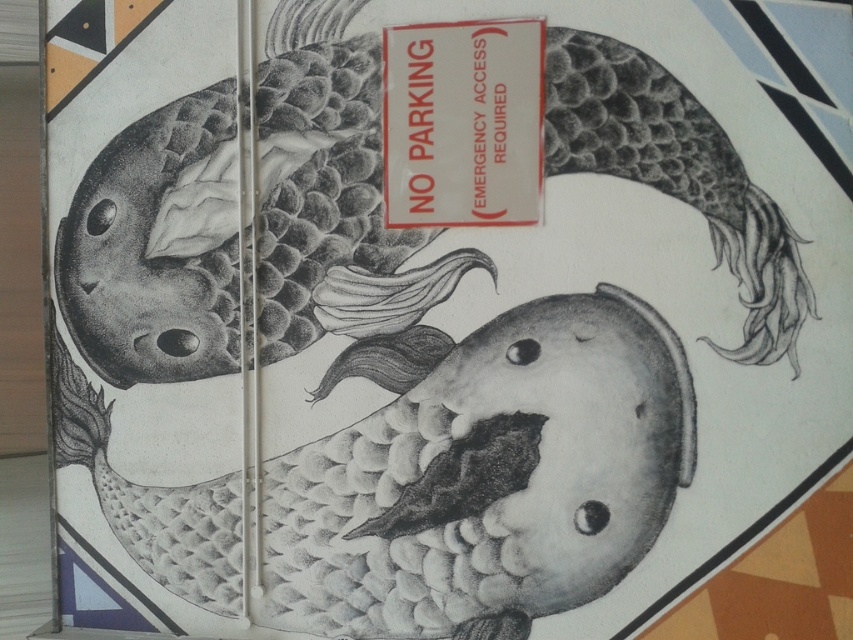
Based on the photo, you are an artist who wants to frame the gray textured fish at center and the white paper sign at upper center with two separate frames. Which object requires a wider frame?

The gray textured fish at center requires a wider frame because its width is larger than the white paper sign at upper center.

Based on the scene description, where exactly is the gray textured fish at center located in terms of coordinates?

The gray textured fish at center is located at coordinates point (155, 248).

You are an artist who wants to add a small star sticker to the image. The sticker must be placed exactly at point [155,248]. Where on the image will the star sticker be placed?

The point [155,248] is on the gray textured fish at center, so the star sticker will be placed on the gray textured fish at center.